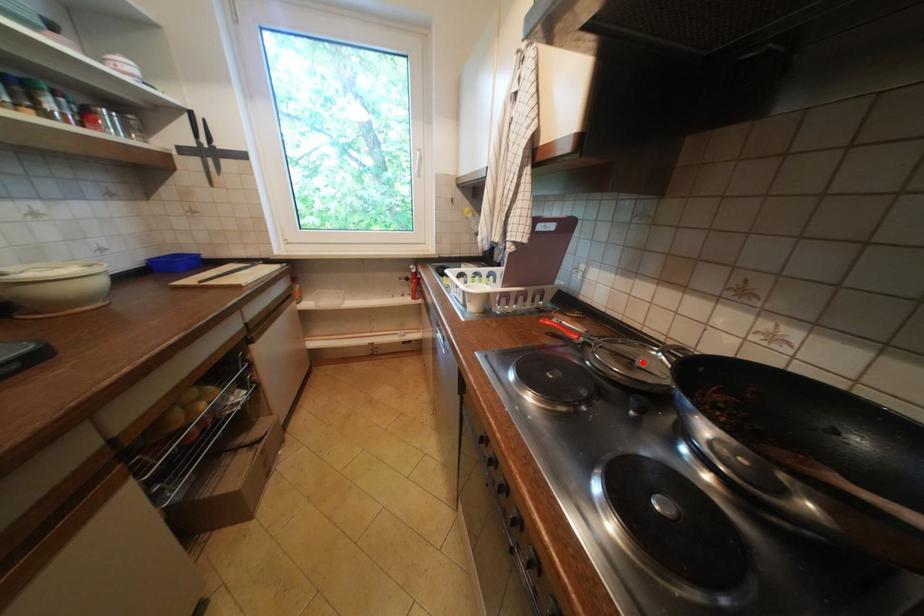
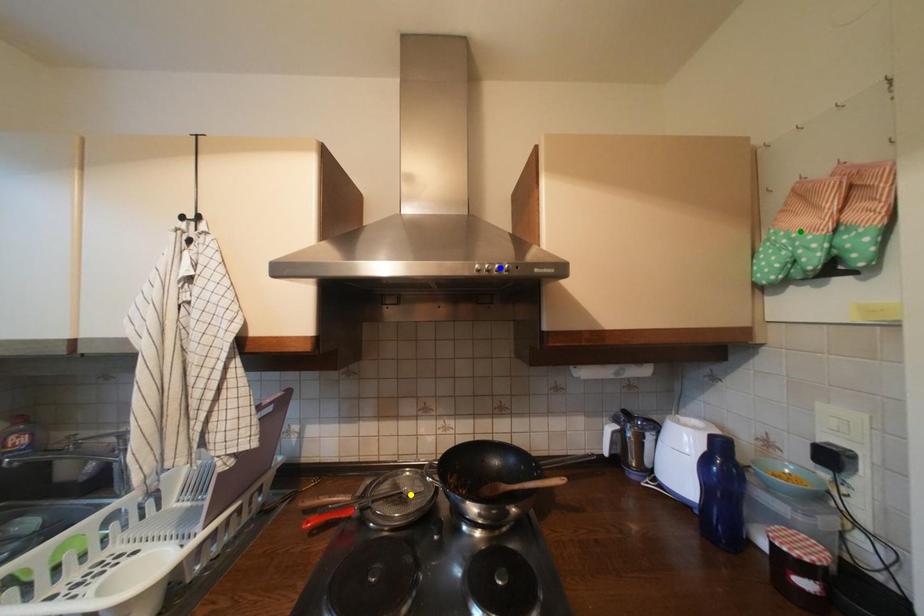
Question: I am providing you with two images of the same scene from different viewpoints. A red point is marked on the first image. You are given multiple points on the second image. Which mark in image 2 goes with the point in image 1?

Choices:
 (A) yellow point
 (B) blue point
 (C) green point

Answer: (A)